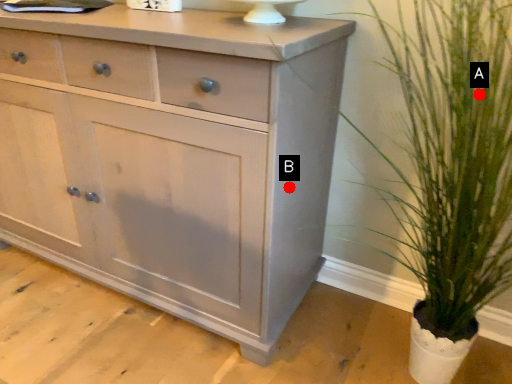
Question: Two points are circled on the image, labeled by A and B beside each circle. Which point appears farthest from the camera in this image?

Choices:
 (A) A is further
 (B) B is further

Answer: (B)